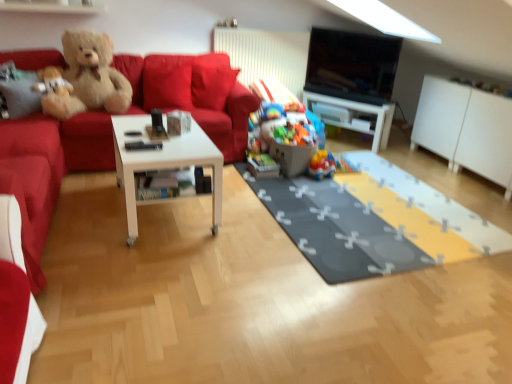
This screenshot has width=512, height=384. I want to click on free location to the right of translucent plastic toy at center, the first toy in the right-to-left sequence, so click(x=345, y=174).